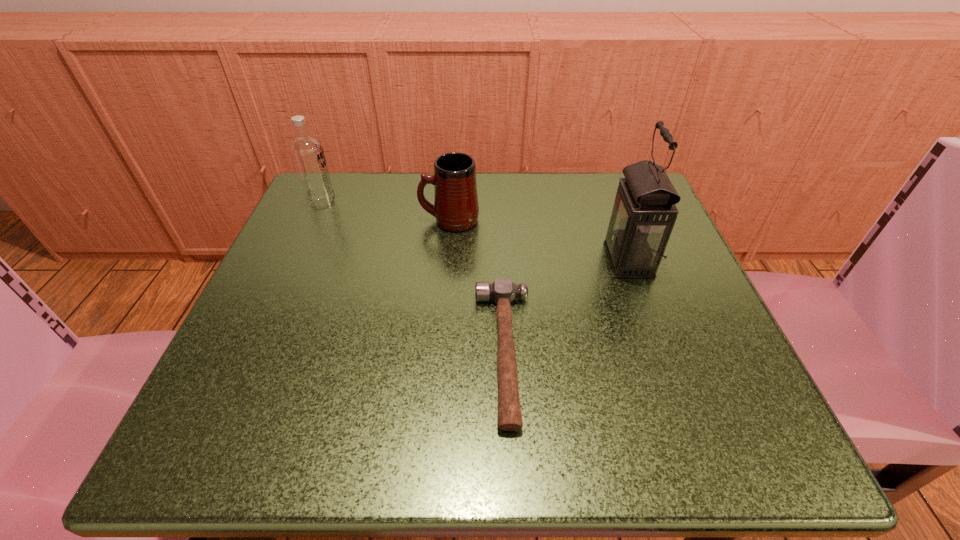
Find the location of a particular element. The height and width of the screenshot is (540, 960). vacant space located 0.120m on the front label of the leftmost object is located at coordinates (394, 205).

Locate an element on the screen. Image resolution: width=960 pixels, height=540 pixels. free space located on the side of the mug with the handle is located at coordinates (317, 220).

Find the location of a particular element. blank space located 0.080m on the side of the mug with the handle is located at coordinates (381, 220).

I want to click on vacant position located 0.240m on the side of the mug with the handle, so (302, 220).

Locate an element on the screen. The height and width of the screenshot is (540, 960). vacant point located on the striking face of the hammer is located at coordinates (235, 352).

Find the location of `free space located on the striking face of the hammer`. free space located on the striking face of the hammer is located at coordinates (408, 352).

The height and width of the screenshot is (540, 960). What are the coordinates of `free space located 0.230m on the striking face of the hammer` in the screenshot? It's located at (322, 352).

Identify the location of vodka present at the far edge. (307, 152).

Image resolution: width=960 pixels, height=540 pixels. I want to click on mug situated at the far edge, so click(x=456, y=208).

Locate an element on the screen. object situated at the near edge is located at coordinates (502, 291).